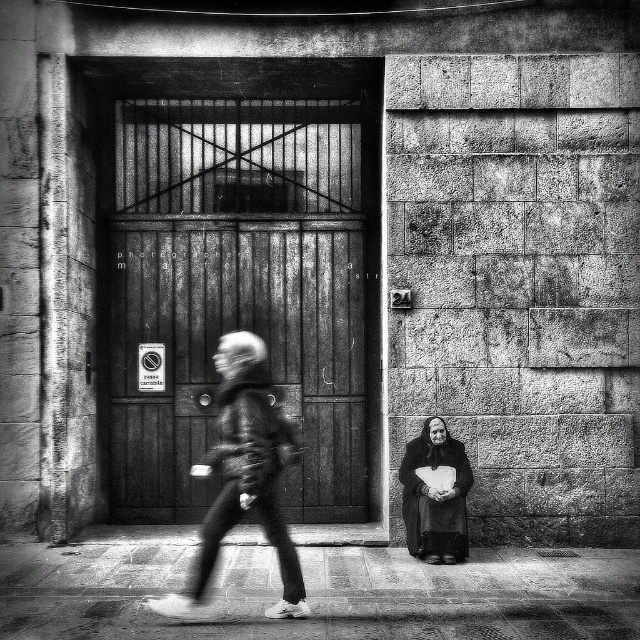
You are standing in front of the wooden door at center. If you want to reach the door, in which direction should you move relative to your current position?

Since the wooden door at center is located at point (214,346), you should move forward towards the center of the image to reach it.

You are standing in the street scene shown in the image. There are two points marked in the image. The first point is at coordinate point (195, 227) and the second point is at coordinate point (445, 515). Which point is closer to you?

Point (195, 227) is closer to you because it is further to the viewer than point (445, 515).

You are a delivery person trying to locate the apartment number 24. You see the gray textured jacket at center and the dark gray fabric at lower right. Which object is closer to you, the delivery person?

The gray textured jacket at center is closer to you because it is in front of the dark gray fabric at lower right.